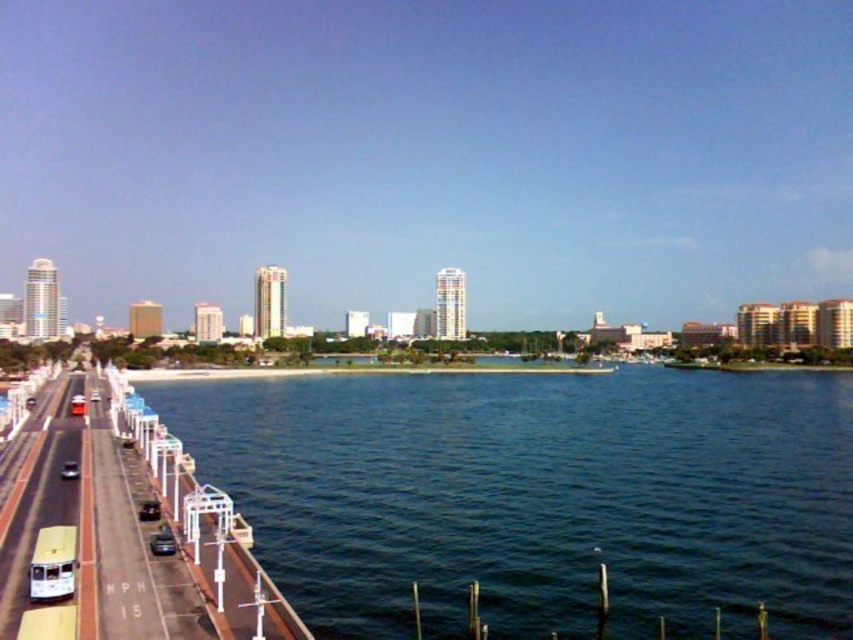
Between shiny black car at lower left and shiny silver car at lower left, which one has less height?

Standing shorter between the two is shiny black car at lower left.

Is shiny black car at lower left to the right of shiny silver car at lower left from the viewer's perspective?

Yes, shiny black car at lower left is to the right of shiny silver car at lower left.

Is point (169, 544) positioned behind point (61, 470)?

No, (169, 544) is closer to viewer.

The image size is (853, 640). Identify the location of shiny black car at lower left. click(161, 541).

Who is positioned more to the left, clear blue water at center or shiny black car at lower left?

shiny black car at lower left is more to the left.

Identify the location of clear blue water at center. (538, 497).

Who is taller, clear blue water at center or shiny silver car at lower left?

Standing taller between the two is clear blue water at center.

Does clear blue water at center lie in front of shiny silver car at lower left?

Yes.

Which is in front, point (381, 433) or point (67, 472)?

Positioned in front is point (67, 472).

The height and width of the screenshot is (640, 853). Identify the location of clear blue water at center. (538, 497).